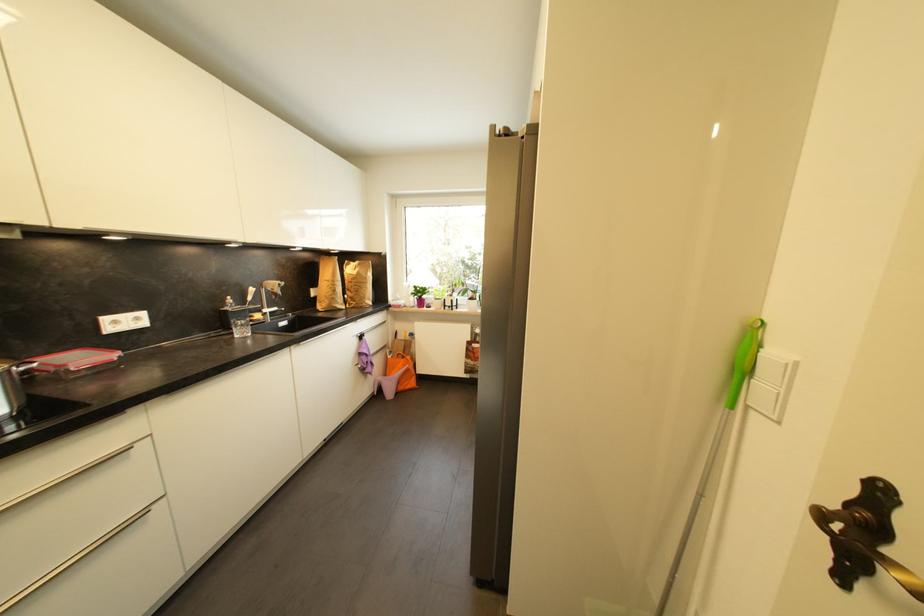
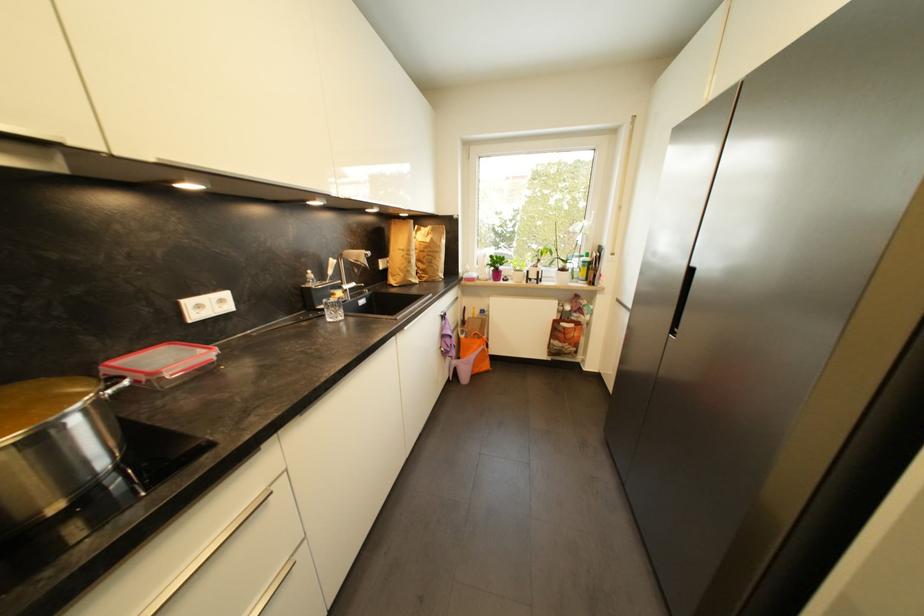
The point at [390,349] is marked in the first image. Where is the corresponding point in the second image?

(463, 328)